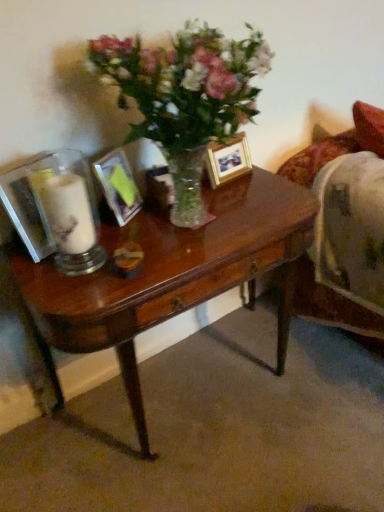
The height and width of the screenshot is (512, 384). Describe the element at coordinates (169, 277) in the screenshot. I see `shiny brown desk at center` at that location.

Identify the location of wooden photo frame at center, the 2th picture frame positioned from the front. This screenshot has width=384, height=512. (228, 160).

Locate an element on the screen. shiny brown desk at center is located at coordinates (169, 277).

From a real-world perspective, which is physically above, shiny brown desk at center or metallic silver picture frame at center, the 1th picture frame viewed from the left?

metallic silver picture frame at center, the 1th picture frame viewed from the left, is physically above.

Which of these two, shiny brown desk at center or metallic silver picture frame at center, the 2th picture frame from the right, is thinner?

metallic silver picture frame at center, the 2th picture frame from the right, is thinner.

Is shiny brown desk at center inside the boundaries of metallic silver picture frame at center, the 1th picture frame viewed from the left, or outside?

shiny brown desk at center is spatially situated outside metallic silver picture frame at center, the 1th picture frame viewed from the left.

Locate an element on the screen. Image resolution: width=384 pixels, height=512 pixels. desk below the wooden photo frame at center, which is counted as the 1th picture frame, starting from the right (from the image's perspective) is located at coordinates (169, 277).

Based on the photo, between shiny brown desk at center and wooden photo frame at center, the 2th picture frame positioned from the front, which one has larger width?

shiny brown desk at center is wider.

Is shiny brown desk at center at the left side of wooden photo frame at center, which is the first picture frame from back to front?

Indeed, shiny brown desk at center is positioned on the left side of wooden photo frame at center, which is the first picture frame from back to front.

Consider the image. How different are the orientations of shiny brown desk at center and wooden photo frame at center, which is the first picture frame from back to front, in degrees?

The facing directions of shiny brown desk at center and wooden photo frame at center, which is the first picture frame from back to front, are 5.63 degrees apart.

Which object is thinner, metallic silver picture frame at center, positioned as the second picture frame in back-to-front order, or white matte candle at left?

Thinner between the two is metallic silver picture frame at center, positioned as the second picture frame in back-to-front order.

Where is `tableware above the metallic silver picture frame at center, arranged as the first picture frame when viewed from the front (from a real-world perspective)`? The image size is (384, 512). tableware above the metallic silver picture frame at center, arranged as the first picture frame when viewed from the front (from a real-world perspective) is located at coordinates (56, 211).

Is metallic silver picture frame at center, positioned as the second picture frame in back-to-front order, not close to white matte candle at left?

No, metallic silver picture frame at center, positioned as the second picture frame in back-to-front order, is in close proximity to white matte candle at left.

Is metallic silver picture frame at center, positioned as the second picture frame in back-to-front order, positioned with its back to white matte candle at left?

metallic silver picture frame at center, positioned as the second picture frame in back-to-front order, does not have its back to white matte candle at left.

Is shiny brown desk at center positioned behind white matte candle at left?

No, shiny brown desk at center is in front of white matte candle at left.

Measure the distance from shiny brown desk at center to white matte candle at left.

shiny brown desk at center is 9.57 inches away from white matte candle at left.

At what (x,y) coordinates should I click in order to perform the action: click on desk that is on the right side of white matte candle at left. Please return your answer as a coordinate pair (x, y). Looking at the image, I should click on (169, 277).

From the image's perspective, between shiny brown desk at center and white matte candle at left, who is located below?

shiny brown desk at center appears lower in the image.

Is metallic silver picture frame at center, arranged as the first picture frame when viewed from the front, surrounding wooden photo frame at center, the 2th picture frame positioned from the front?

No.

From the image's perspective, relative to wooden photo frame at center, which is the second picture frame in left-to-right order, is metallic silver picture frame at center, the 2th picture frame from the right, above or below?

Based on their image positions, metallic silver picture frame at center, the 2th picture frame from the right, is located beneath wooden photo frame at center, which is the second picture frame in left-to-right order.

Visually, is metallic silver picture frame at center, the 2th picture frame from the right, positioned to the left or to the right of wooden photo frame at center, which is the second picture frame in left-to-right order?

From the image, it's evident that metallic silver picture frame at center, the 2th picture frame from the right, is to the left of wooden photo frame at center, which is the second picture frame in left-to-right order.

Which of these two, metallic silver picture frame at center, the 1th picture frame viewed from the left, or wooden photo frame at center, which is the first picture frame from back to front, is wider?

metallic silver picture frame at center, the 1th picture frame viewed from the left.

Is metallic silver picture frame at center, positioned as the second picture frame in back-to-front order, in front of or behind shiny brown desk at center in the image?

metallic silver picture frame at center, positioned as the second picture frame in back-to-front order, is behind shiny brown desk at center.

Considering the sizes of metallic silver picture frame at center, arranged as the first picture frame when viewed from the front, and shiny brown desk at center in the image, is metallic silver picture frame at center, arranged as the first picture frame when viewed from the front, taller or shorter than shiny brown desk at center?

Considering their sizes, metallic silver picture frame at center, arranged as the first picture frame when viewed from the front, has less height than shiny brown desk at center.

Would you say metallic silver picture frame at center, positioned as the second picture frame in back-to-front order, is to the left or to the right of shiny brown desk at center in the picture?

Clearly, metallic silver picture frame at center, positioned as the second picture frame in back-to-front order, is on the left of shiny brown desk at center in the image.

Is white matte candle at left positioned with its back to metallic silver picture frame at center, arranged as the first picture frame when viewed from the front?

No, white matte candle at left is not facing away from metallic silver picture frame at center, arranged as the first picture frame when viewed from the front.

Is point (37, 170) positioned before point (102, 166)?

Yes, it is in front of point (102, 166).

This screenshot has width=384, height=512. In order to click on tableware below the metallic silver picture frame at center, the 2th picture frame from the right (from the image's perspective) in this screenshot , I will do `click(56, 211)`.

Does white matte candle at left appear on the left side of metallic silver picture frame at center, positioned as the second picture frame in back-to-front order?

Yes, white matte candle at left is to the left of metallic silver picture frame at center, positioned as the second picture frame in back-to-front order.

This screenshot has height=512, width=384. What are the coordinates of `desk directly beneath the metallic silver picture frame at center, the 2th picture frame from the right (from a real-world perspective)` in the screenshot? It's located at (169, 277).

Where is `desk lying on the left of wooden photo frame at center, the 2th picture frame positioned from the front`? The height and width of the screenshot is (512, 384). desk lying on the left of wooden photo frame at center, the 2th picture frame positioned from the front is located at coordinates (169, 277).

Based on their spatial positions, is metallic silver picture frame at center, the 1th picture frame viewed from the left, or white matte candle at left further from shiny brown desk at center?

metallic silver picture frame at center, the 1th picture frame viewed from the left, lies further to shiny brown desk at center than the other object.

Based on their spatial positions, is shiny brown desk at center or metallic silver picture frame at center, the 1th picture frame viewed from the left, closer to wooden photo frame at center, which is the second picture frame in left-to-right order?

metallic silver picture frame at center, the 1th picture frame viewed from the left, is closer to wooden photo frame at center, which is the second picture frame in left-to-right order.

Looking at the image, which one is located further to white matte candle at left, shiny brown desk at center or wooden photo frame at center, which is counted as the 1th picture frame, starting from the right?

Based on the image, wooden photo frame at center, which is counted as the 1th picture frame, starting from the right, appears to be further to white matte candle at left.

Based on their spatial positions, is wooden photo frame at center, which is counted as the 1th picture frame, starting from the right, or white matte candle at left further from metallic silver picture frame at center, the 1th picture frame viewed from the left?

wooden photo frame at center, which is counted as the 1th picture frame, starting from the right, is further to metallic silver picture frame at center, the 1th picture frame viewed from the left.

Based on their spatial positions, is white matte candle at left or shiny brown desk at center further from metallic silver picture frame at center, arranged as the first picture frame when viewed from the front?

The object further to metallic silver picture frame at center, arranged as the first picture frame when viewed from the front, is shiny brown desk at center.

From the picture: Considering their positions, is white matte candle at left positioned further to shiny brown desk at center than wooden photo frame at center, which is the second picture frame in left-to-right order?

Among the two, wooden photo frame at center, which is the second picture frame in left-to-right order, is located further to shiny brown desk at center.

Looking at the image, which one is located further to wooden photo frame at center, the 2th picture frame positioned from the front, metallic silver picture frame at center, positioned as the second picture frame in back-to-front order, or white matte candle at left?

white matte candle at left.

Considering their positions, is wooden photo frame at center, which is counted as the 1th picture frame, starting from the right, positioned further to shiny brown desk at center than metallic silver picture frame at center, arranged as the first picture frame when viewed from the front?

The object further to shiny brown desk at center is wooden photo frame at center, which is counted as the 1th picture frame, starting from the right.

Image resolution: width=384 pixels, height=512 pixels. In order to click on picture frame between wooden photo frame at center, which is the first picture frame from back to front, and shiny brown desk at center, in the vertical direction in this screenshot , I will do `click(118, 185)`.

You are a GUI agent. You are given a task and a screenshot of the screen. Output one action in this format:
    pyautogui.click(x=<x>, y=<y>)
    Task: Click on the desk situated between white matte candle at left and wooden photo frame at center, which is the first picture frame from back to front, from left to right
    
    Given the screenshot: What is the action you would take?
    pyautogui.click(x=169, y=277)

You are a GUI agent. You are given a task and a screenshot of the screen. Output one action in this format:
    pyautogui.click(x=<x>, y=<y>)
    Task: Click on the picture frame between white matte candle at left and wooden photo frame at center, which is the second picture frame in left-to-right order, from left to right
    The width and height of the screenshot is (384, 512).
    Given the screenshot: What is the action you would take?
    pyautogui.click(x=118, y=185)

Locate an element on the screen. The height and width of the screenshot is (512, 384). tableware between metallic silver picture frame at center, positioned as the second picture frame in back-to-front order, and shiny brown desk at center in the up-down direction is located at coordinates (56, 211).